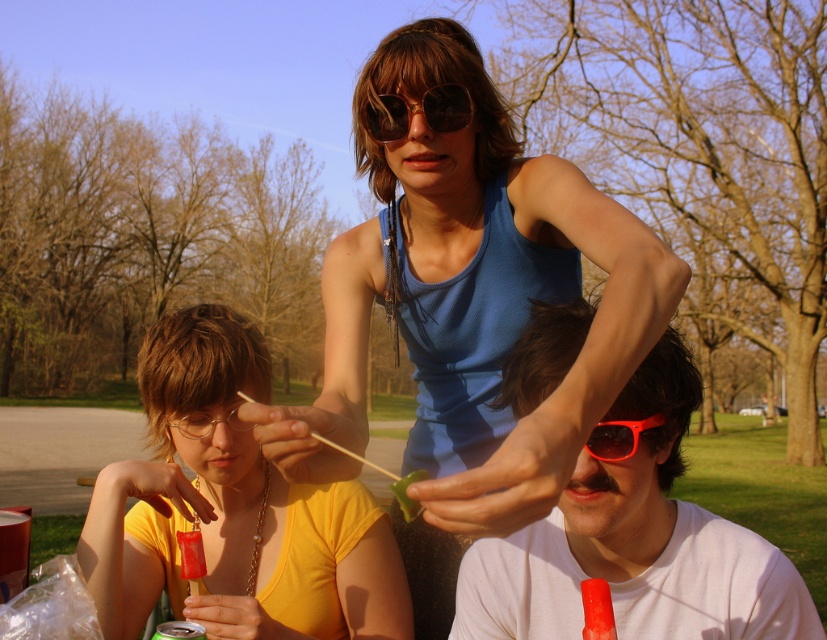
Question: Which point is farther to the camera?

Choices:
 (A) (160, 422)
 (B) (369, 108)
 (C) (227, 412)

Answer: (A)

Question: Is yellow matte shirt at lower left bigger than white matte shirt at lower right?

Choices:
 (A) yes
 (B) no

Answer: (A)

Question: Among these objects, which one is farthest from the camera?

Choices:
 (A) blue tank top at center
 (B) white matte shirt at lower right
 (C) sunglasses at center
 (D) clear plastic glasses at lower left

Answer: (D)

Question: Which object is positioned farthest from the red plastic sunglasses at upper center?

Choices:
 (A) yellow matte shirt at lower left
 (B) blue tank top at center
 (C) white matte shirt at lower right

Answer: (A)

Question: Observing the image, what is the correct spatial positioning of red plastic sunglasses at upper center in reference to clear plastic glasses at lower left?

Choices:
 (A) below
 (B) above

Answer: (B)

Question: Can you confirm if yellow matte shirt at lower left is positioned to the right of clear plastic glasses at lower left?

Choices:
 (A) yes
 (B) no

Answer: (A)